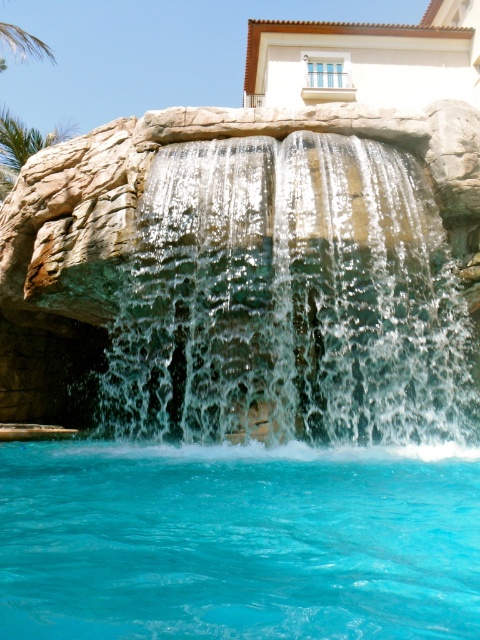
Question: Does clear water cascade at center have a smaller size compared to turquoise glossy water at lower center?

Choices:
 (A) yes
 (B) no

Answer: (B)

Question: Which object appears closest to the camera in this image?

Choices:
 (A) clear water cascade at center
 (B) turquoise glossy water at lower center

Answer: (B)

Question: Which point appears farthest from the camera in this image?

Choices:
 (A) (400, 253)
 (B) (379, 512)

Answer: (A)

Question: Observing the image, what is the correct spatial positioning of clear water cascade at center in reference to turquoise glossy water at lower center?

Choices:
 (A) above
 (B) below

Answer: (A)

Question: Is clear water cascade at center positioned before turquoise glossy water at lower center?

Choices:
 (A) no
 (B) yes

Answer: (A)